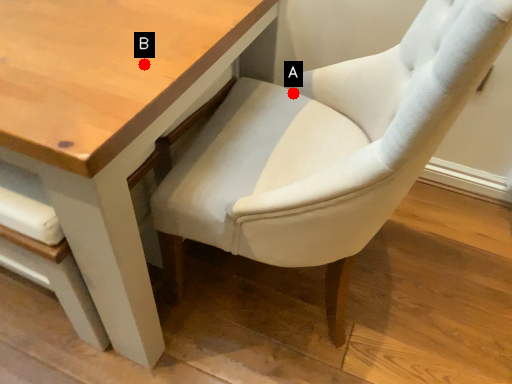
Question: Two points are circled on the image, labeled by A and B beside each circle. Which point is further to the camera?

Choices:
 (A) A is further
 (B) B is further

Answer: (A)